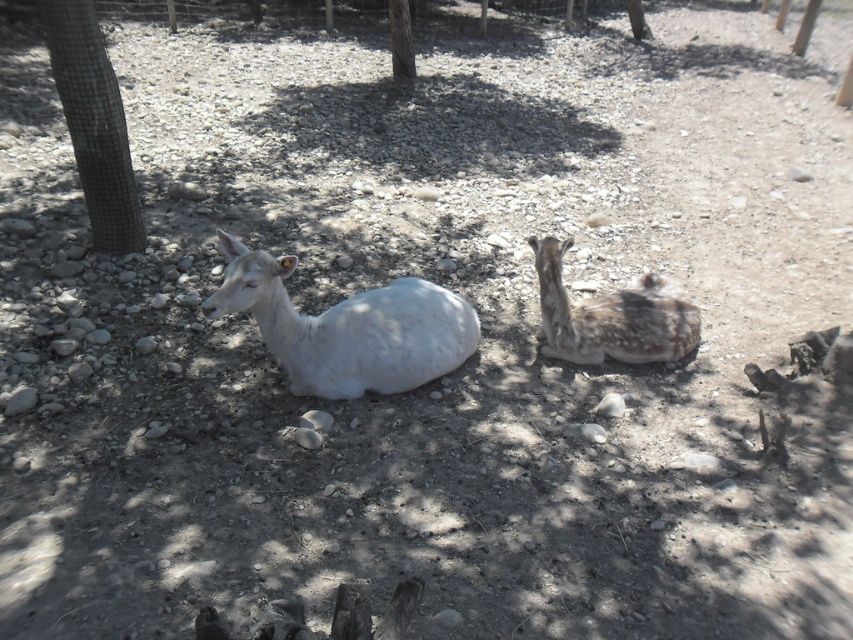
Who is higher up, white fur goat at center or smooth bark tree at upper center?

Positioned higher is smooth bark tree at upper center.

Is point (410, 301) farther from camera compared to point (404, 61)?

No, it is not.

I want to click on white fur goat at center, so coord(347,326).

Who is more forward, (x=90, y=6) or (x=395, y=67)?

Point (x=90, y=6) is in front.

Can you confirm if mesh wire fence at upper left is positioned above smooth bark tree at upper center?

Actually, mesh wire fence at upper left is below smooth bark tree at upper center.

Image resolution: width=853 pixels, height=640 pixels. Describe the element at coordinates (93, 122) in the screenshot. I see `mesh wire fence at upper left` at that location.

The width and height of the screenshot is (853, 640). In order to click on mesh wire fence at upper left in this screenshot , I will do `click(93, 122)`.

Who is more distant from viewer, [469,320] or [670,356]?

Point [670,356]

Does white fur goat at center come in front of fawn fur coat at center?

That is True.

Which is in front, point (370, 376) or point (612, 292)?

Positioned in front is point (370, 376).

Where is `white fur goat at center`? white fur goat at center is located at coordinates (347, 326).